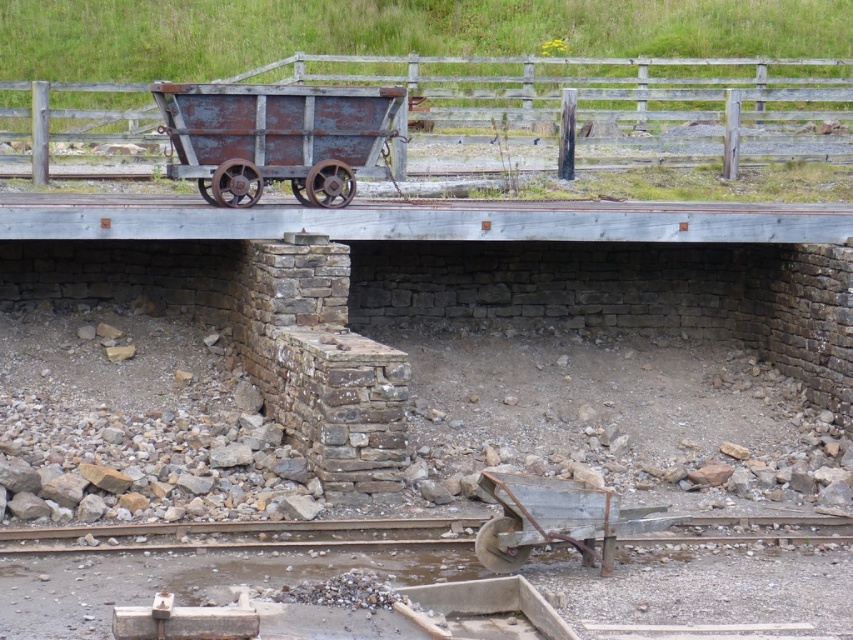
You are a maintenance worker inspecting the bridge. You notice two rusty metal items on the bridge deck. Which one is taller, the rusty metal cart at center or the rusty metal wagon at lower center?

The rusty metal cart at center is taller than the rusty metal wagon at lower center.